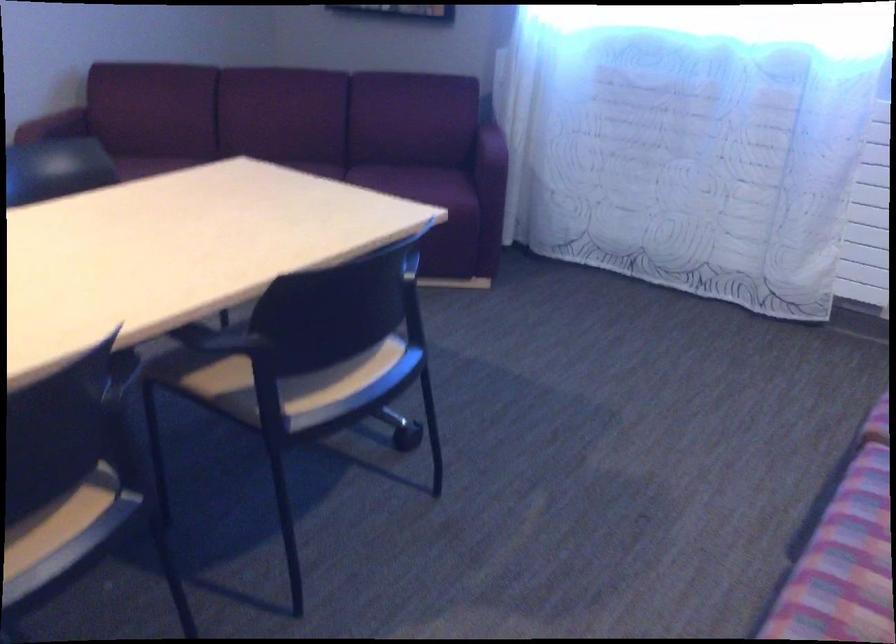
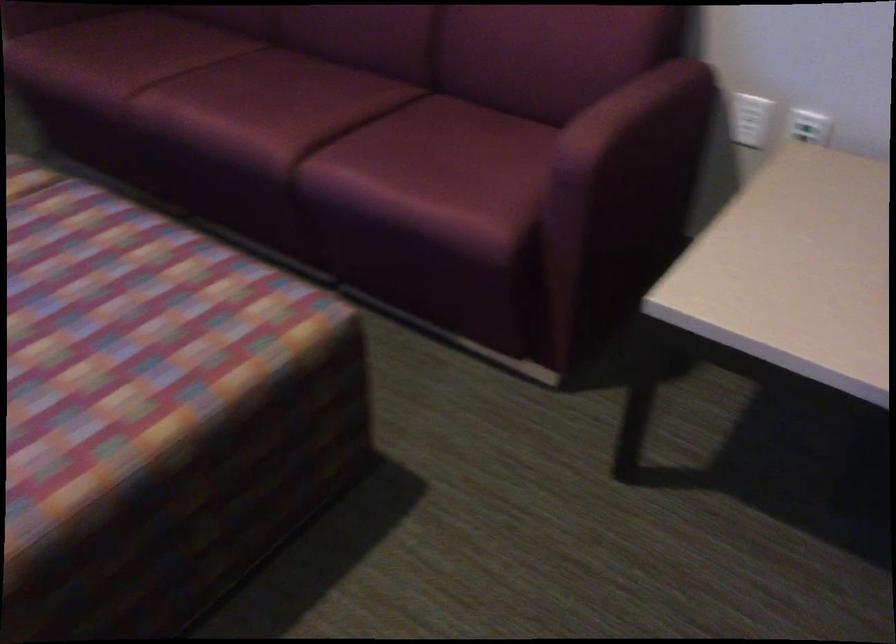
How did the camera likely rotate?

The camera's rotation is toward right-down.